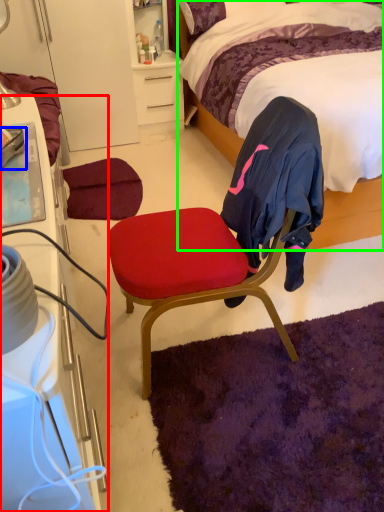
Question: Estimate the real-world distances between objects in this image. Which object is farther from cabinetry (highlighted by a red box), sneakers (highlighted by a blue box) or bed (highlighted by a green box)?

Choices:
 (A) sneakers
 (B) bed

Answer: (B)